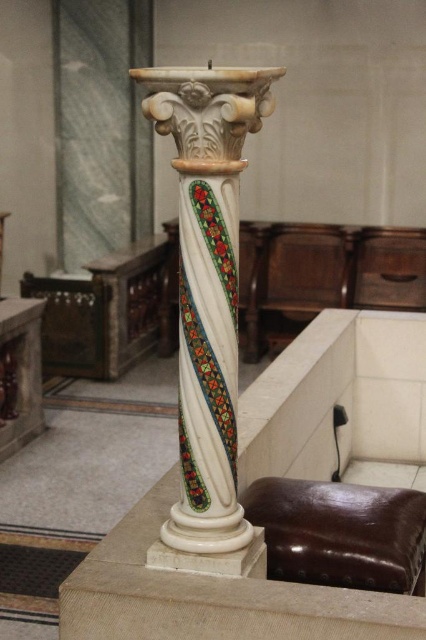
Question: Can you confirm if white marble column at center is bigger than brown leather stool at lower center?

Choices:
 (A) yes
 (B) no

Answer: (A)

Question: Which of the following is the farthest from the observer?

Choices:
 (A) (388, 576)
 (B) (247, 93)

Answer: (A)

Question: Which of the following is the closest to the observer?

Choices:
 (A) (172, 97)
 (B) (299, 528)

Answer: (A)

Question: Does white marble column at center have a greater width compared to brown leather stool at lower center?

Choices:
 (A) yes
 (B) no

Answer: (B)

Question: From the image, what is the correct spatial relationship of white marble column at center in relation to brown leather stool at lower center?

Choices:
 (A) right
 (B) left

Answer: (B)

Question: Which of the following is the closest to the observer?

Choices:
 (A) brown leather stool at lower center
 (B) white marble column at center

Answer: (B)